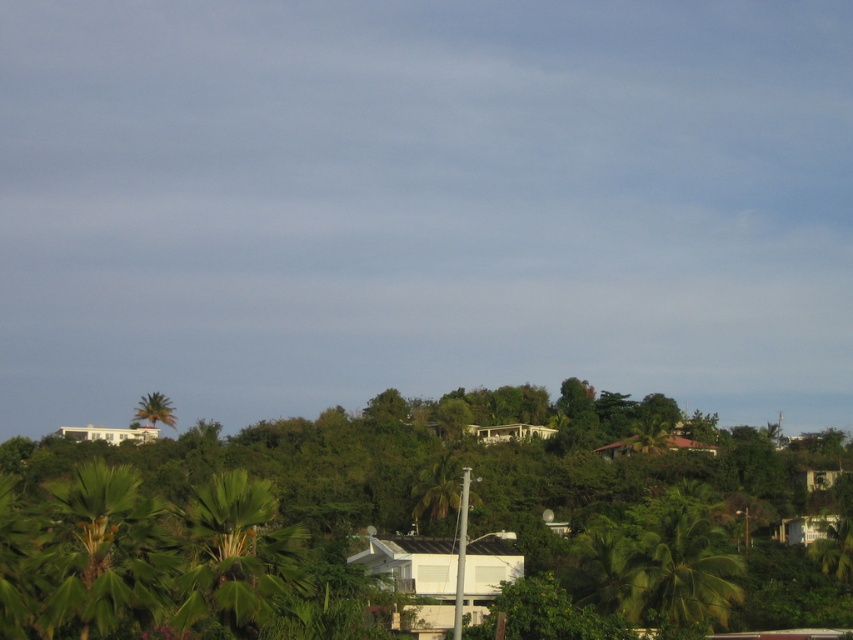
Question: Does green leafy tree at lower right appear over green leafy palm tree at upper left?

Choices:
 (A) no
 (B) yes

Answer: (B)

Question: Which of the following is the farthest from the observer?

Choices:
 (A) green leafy palm tree at upper left
 (B) green leafy tree at center

Answer: (A)

Question: Is green leafy tree at center further to the viewer compared to green leafy palm tree at upper left?

Choices:
 (A) no
 (B) yes

Answer: (A)

Question: Which point is farther to the camera?

Choices:
 (A) green leafy tree at center
 (B) green leafy tree at lower right
 (C) green leafy palm tree at upper left

Answer: (C)

Question: Which object appears closest to the camera in this image?

Choices:
 (A) green leafy tree at lower right
 (B) green leafy palm tree at upper left

Answer: (A)

Question: Considering the relative positions of green leafy tree at lower right and green leafy palm tree at upper left in the image provided, where is green leafy tree at lower right located with respect to green leafy palm tree at upper left?

Choices:
 (A) below
 (B) above

Answer: (B)